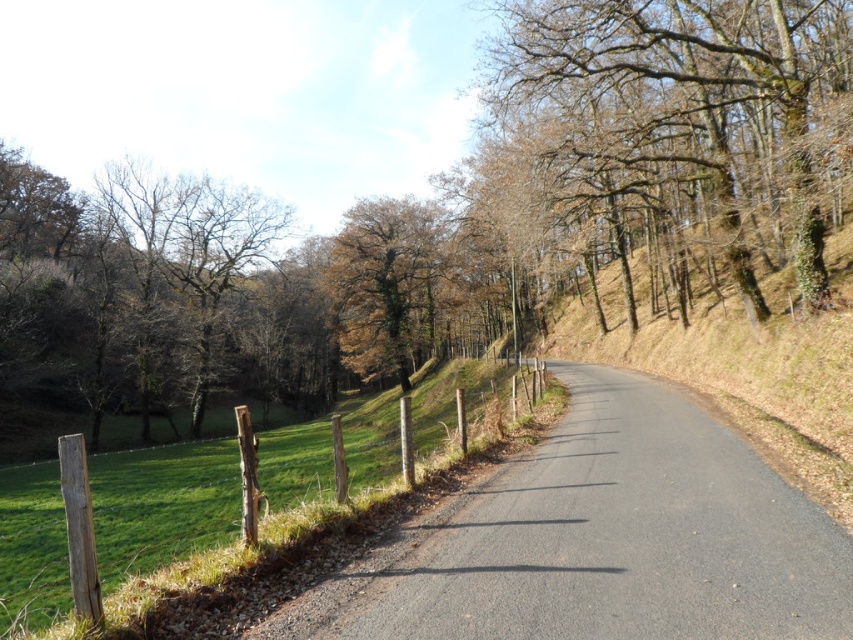
Which is more to the right, asphalt road at center or weathered wood fence at lower left?

Positioned to the right is asphalt road at center.

Who is more forward, (730,609) or (292,531)?

Positioned in front is point (730,609).

Locate an element on the screen. Image resolution: width=853 pixels, height=640 pixels. asphalt road at center is located at coordinates (601, 540).

Can you confirm if weathered wood fence at lower left is bigger than brown rough tree at center?

No.

What do you see at coordinates (303, 538) in the screenshot? The width and height of the screenshot is (853, 640). I see `weathered wood fence at lower left` at bounding box center [303, 538].

Who is more distant from viewer, [486,440] or [357,333]?

Positioned behind is point [357,333].

The width and height of the screenshot is (853, 640). Identify the location of weathered wood fence at lower left. (303, 538).

Is brown leafless tree at upper right closer to camera compared to brown rough tree at center?

Yes, it is.

Does point (724, 26) come farther from viewer compared to point (393, 365)?

No, (724, 26) is closer to viewer.

I want to click on brown leafless tree at upper right, so click(x=682, y=108).